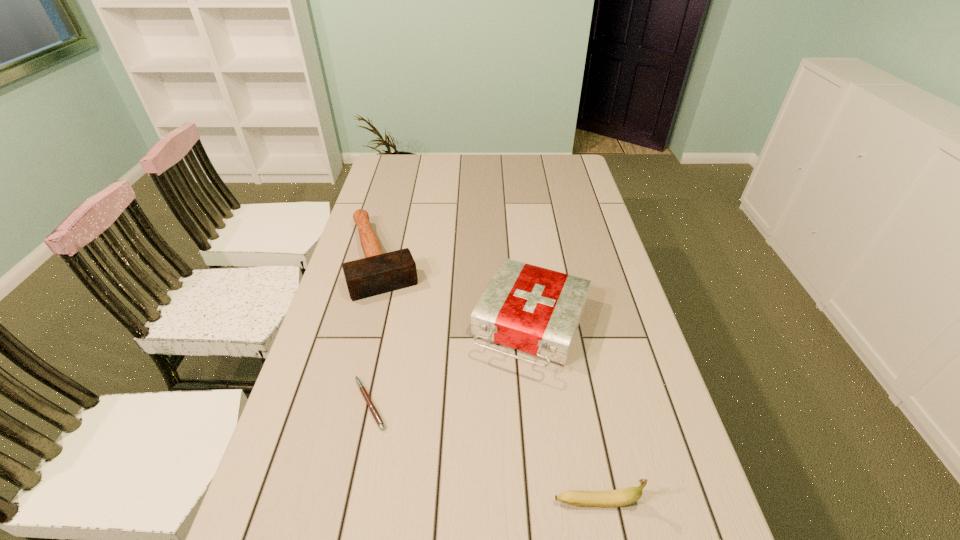
I want to click on free space between the shortest object and the first-aid kit, so click(x=451, y=364).

Identify the location of free space between the shortest object and the mallet. (376, 331).

In order to click on free space between the shortest object and the mallet in this screenshot , I will do `click(376, 331)`.

Find the location of a particular element. vacant region between the banana and the shortest object is located at coordinates (483, 452).

You are a GUI agent. You are given a task and a screenshot of the screen. Output one action in this format:
    pyautogui.click(x=<x>, y=<y>)
    Task: Click on the third closest object to the nearest object
    Image resolution: width=960 pixels, height=540 pixels.
    Given the screenshot: What is the action you would take?
    pyautogui.click(x=377, y=273)

Point out which object is positioned as the second nearest to the first-aid kit. Please provide its 2D coordinates. Your answer should be formatted as a tuple, i.e. [(x, y)], where the tuple contains the x and y coordinates of a point satisfying the conditions above.

[(372, 408)]

Locate an element on the screen. Image resolution: width=960 pixels, height=540 pixels. vacant region that satisfies the following two spatial constraints: 1. on the front side of the nearest object; 2. at the stem of the first-aid kit is located at coordinates (553, 501).

Find the location of a particular element. The width and height of the screenshot is (960, 540). free space in the image that satisfies the following two spatial constraints: 1. on the front side of the mallet; 2. on the right side of the first-aid kit is located at coordinates (366, 325).

At what (x,y) coordinates should I click in order to perform the action: click on free region that satisfies the following two spatial constraints: 1. on the front side of the mallet; 2. on the left side of the first-aid kit. Please return your answer as a coordinate pair (x, y). The image size is (960, 540). Looking at the image, I should click on (366, 325).